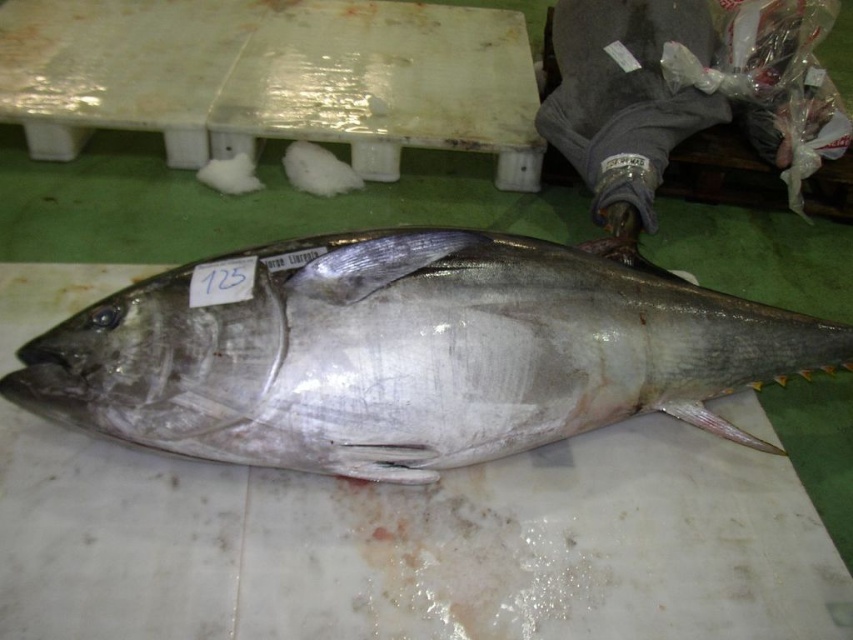
You are standing at the point closest to the tuna fish. Which of the two points, point [131,308] or point [300,83], is closer to you?

Point [131,308] is in front of point [300,83], so it is closer to you.

You are a food safety inspector checking the storage conditions of the shiny silver fish at center and the white plastic table at center. According to the guidelines, the fish must be stored above any tables to prevent contamination from drips. Is the current arrangement compliant with the guidelines?

The shiny silver fish at center is located below white plastic table at center, which violates the guidelines as it is not stored above the table. This could lead to contamination from drips falling onto the fish.